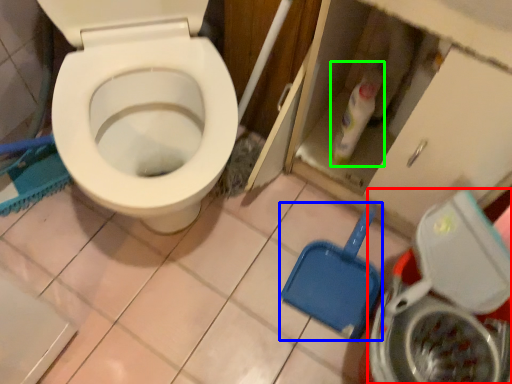
Question: Considering the real-world distances, which object is farthest from washing machine (highlighted by a red box)? shovel (highlighted by a blue box) or cleaning product (highlighted by a green box)?

Choices:
 (A) shovel
 (B) cleaning product

Answer: (B)